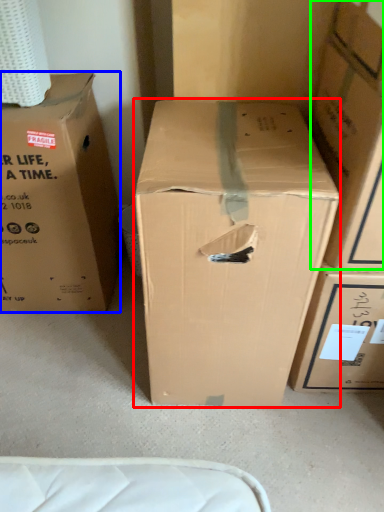
Question: Estimate the real-world distances between objects in this image. Which object is farther from box (highlighted by a red box), box (highlighted by a blue box) or box (highlighted by a green box)?

Choices:
 (A) box
 (B) box

Answer: (A)